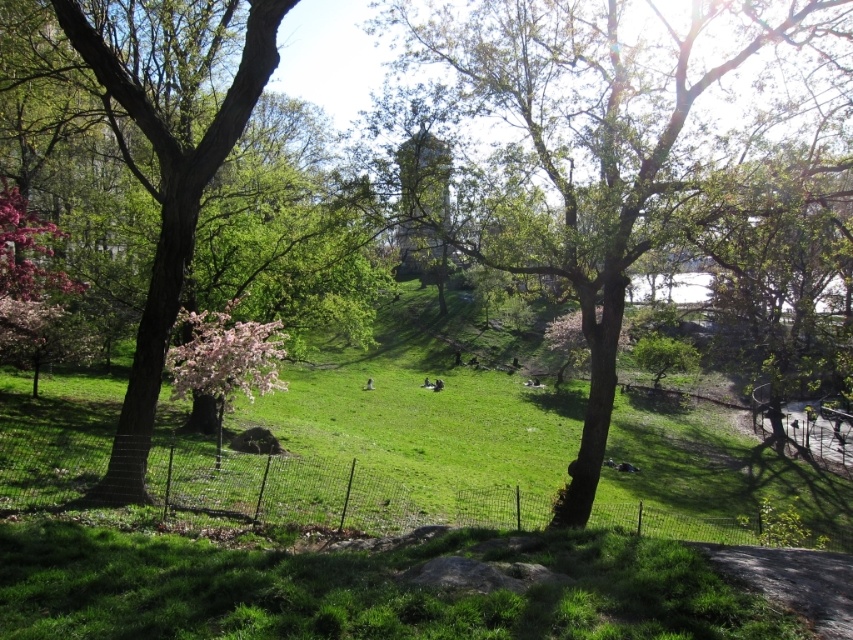
You are standing at the center of the park and want to take a photo of the green leafy tree at center. Which direction should you face to ensure the tree is in the center of your camera frame?

You should face the direction where the green leafy tree at center is located, which is at point coordinates of 0.237 on the x and 0.683 on the y axis. However, since you are already at the center of the park, you need to adjust your position to align the tree properly. But according to the given coordinates, the tree is already at the center point of the image, so facing towards it would naturally center it in your camera frame.

You are a gardener who needs to place a 5 meter long fence between the green leafy tree at center and the smooth brown tree trunk at left. Is there enough space between them to install the fence?

The distance between the green leafy tree at center and the smooth brown tree trunk at left is 7.60 meters. Since the fence is only 5 meters long, there is sufficient space to place it between them.